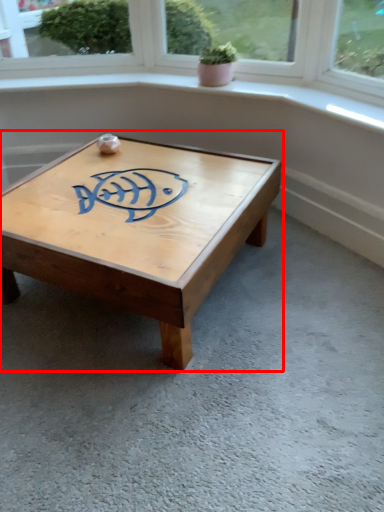
Question: Considering the relative positions of coffee table (annotated by the red box) and houseplant in the image provided, where is coffee table (annotated by the red box) located with respect to the staircase?

Choices:
 (A) right
 (B) left

Answer: (B)